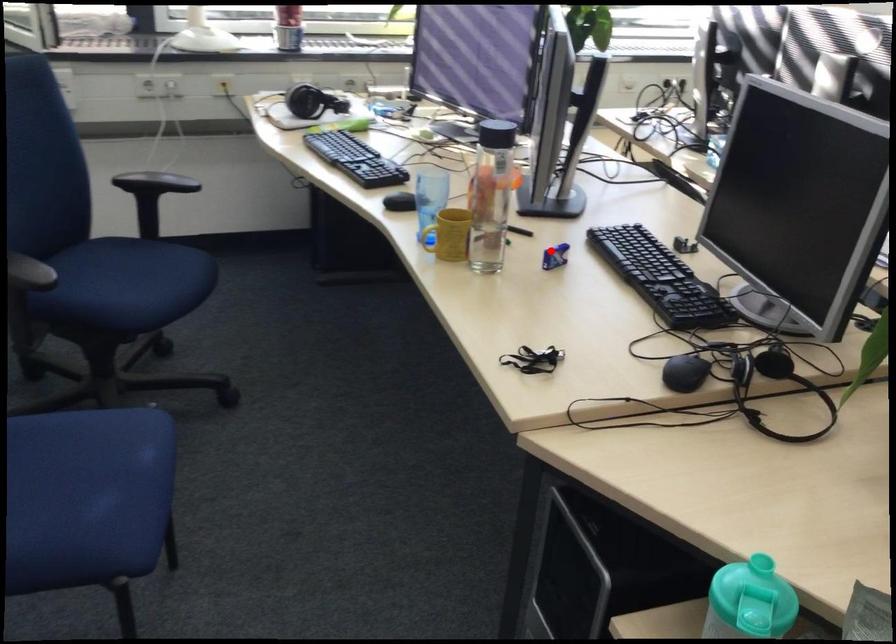
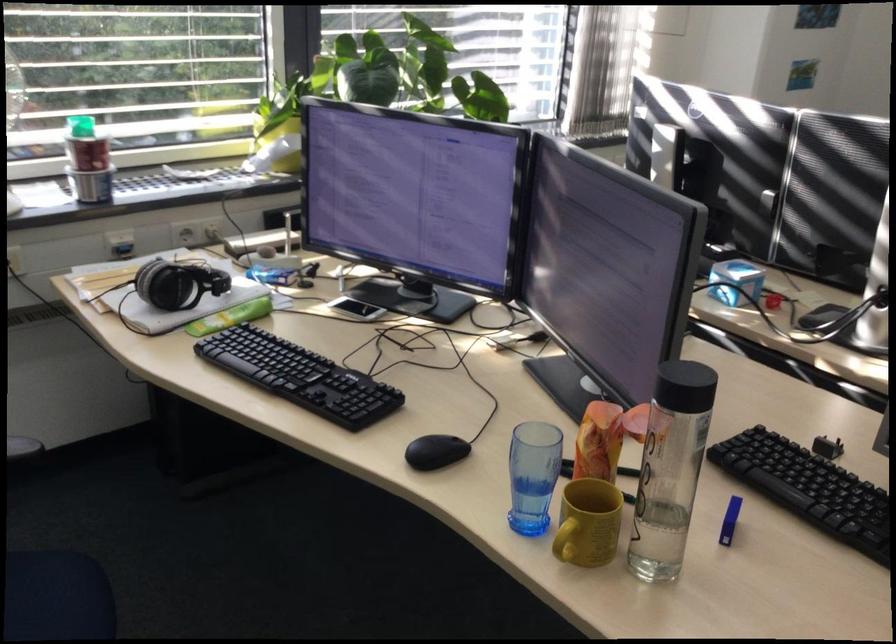
Where in the second image is the point corresponding to the highlighted location from the first image?

(729, 520)